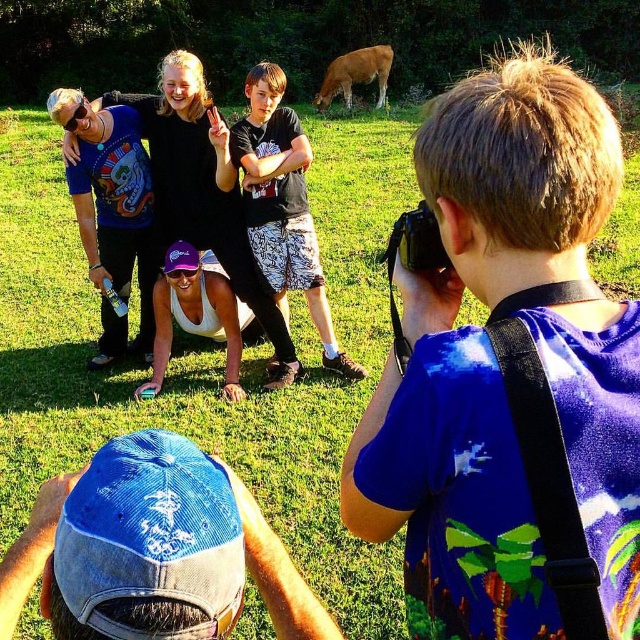
Question: Considering the relative positions of black cotton shirt at center and brown furry cow at upper center in the image provided, where is black cotton shirt at center located with respect to brown furry cow at upper center?

Choices:
 (A) left
 (B) right

Answer: (A)

Question: Is black cotton shirt at center positioned in front of brown furry cow at upper center?

Choices:
 (A) yes
 (B) no

Answer: (A)

Question: Which point is closer to the camera?

Choices:
 (A) black cotton shirt at center
 (B) brown furry cow at upper center

Answer: (A)

Question: Is black cotton shirt at center to the left of brown furry cow at upper center from the viewer's perspective?

Choices:
 (A) yes
 (B) no

Answer: (A)

Question: Which of the following is the closest to the observer?

Choices:
 (A) black cotton shirt at center
 (B) brown furry cow at upper center

Answer: (A)

Question: Among these points, which one is farthest from the camera?

Choices:
 (A) (369, 68)
 (B) (268, 161)

Answer: (A)